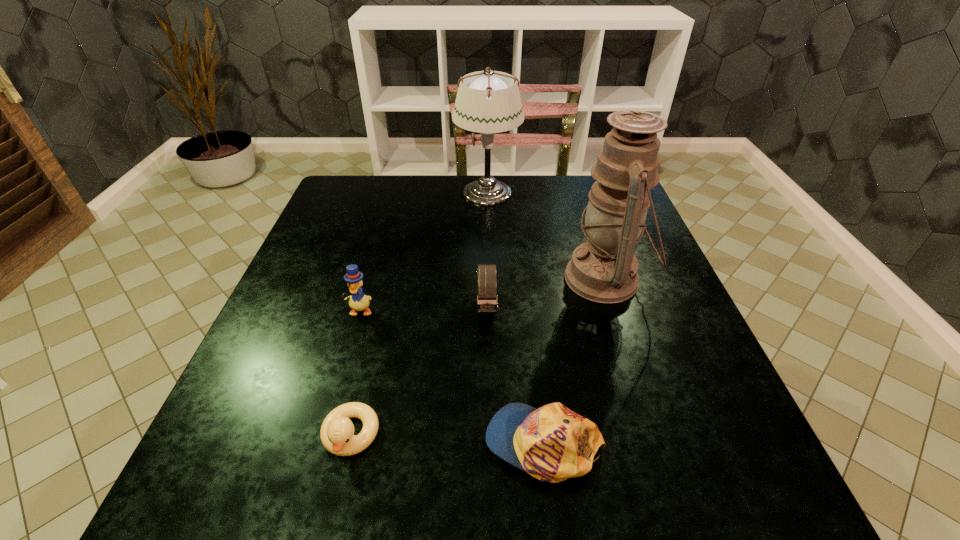
Find the location of `vacant region at the far edge of the desktop`. vacant region at the far edge of the desktop is located at coordinates (412, 178).

Locate an element on the screen. blank area at the near edge is located at coordinates (516, 511).

Locate an element on the screen. This screenshot has width=960, height=540. blank area at the left edge is located at coordinates coord(294,274).

At what (x,y) coordinates should I click in order to perform the action: click on vacant space at the right edge. Please return your answer as a coordinate pair (x, y). Looking at the image, I should click on (732, 398).

Locate an element on the screen. The image size is (960, 540). blank space at the far left corner of the desktop is located at coordinates (348, 217).

In the image, there is a desktop. In order to click on vacant space at the far right corner in this screenshot , I will do `click(573, 182)`.

At what (x,y) coordinates should I click in order to perform the action: click on free space at the near right corner. Please return your answer as a coordinate pair (x, y). This screenshot has height=540, width=960. Looking at the image, I should click on (689, 500).

Image resolution: width=960 pixels, height=540 pixels. I want to click on free space between the lampshade and the watch, so click(x=487, y=250).

Find the location of a particular element. The width and height of the screenshot is (960, 540). vacant area that lies between the taller duckling and the shorter duckling is located at coordinates (355, 373).

You are a GUI agent. You are given a task and a screenshot of the screen. Output one action in this format:
    pyautogui.click(x=<x>, y=<y>)
    Task: Click on the free space between the farthest object and the taller duckling
    The width and height of the screenshot is (960, 540).
    Given the screenshot: What is the action you would take?
    pyautogui.click(x=423, y=252)